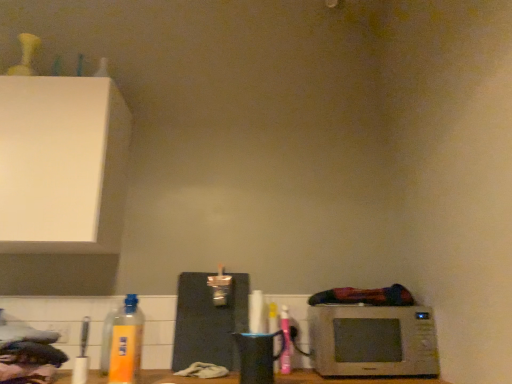
Question: Is pink matte spray can at lower right, the 3th bottle positioned from the left, thinner than white plastic electric outlet at lower left?

Choices:
 (A) yes
 (B) no

Answer: (B)

Question: Does pink matte spray can at lower right, the 3th bottle positioned from the left, come behind white plastic electric outlet at lower left?

Choices:
 (A) yes
 (B) no

Answer: (B)

Question: Can you confirm if pink matte spray can at lower right, positioned as the 3th bottle in front-to-back order, is taller than white plastic electric outlet at lower left?

Choices:
 (A) no
 (B) yes

Answer: (B)

Question: Considering the relative positions of pink matte spray can at lower right, arranged as the 1th bottle when viewed from the back, and white plastic electric outlet at lower left in the image provided, is pink matte spray can at lower right, arranged as the 1th bottle when viewed from the back, to the left of white plastic electric outlet at lower left from the viewer's perspective?

Choices:
 (A) no
 (B) yes

Answer: (A)

Question: From a real-world perspective, is pink matte spray can at lower right, the 3th bottle positioned from the left, under white plastic electric outlet at lower left?

Choices:
 (A) yes
 (B) no

Answer: (B)

Question: Is point (101, 360) closer or farther from the camera than point (389, 309)?

Choices:
 (A) farther
 (B) closer

Answer: (A)

Question: Is yellow matte bottle at lower left, which appears as the 3th bottle when viewed from the right, spatially inside silver metallic microwave at lower right, or outside of it?

Choices:
 (A) inside
 (B) outside

Answer: (B)

Question: From the image's perspective, is yellow matte bottle at lower left, acting as the second bottle starting from the front, located above or below silver metallic microwave at lower right?

Choices:
 (A) below
 (B) above

Answer: (B)

Question: From a real-world perspective, relative to silver metallic microwave at lower right, is yellow matte bottle at lower left, the first bottle from the left, vertically above or below?

Choices:
 (A) above
 (B) below

Answer: (A)

Question: Looking at their shapes, would you say yellow matte bottle at lower left, placed as the 2th bottle when sorted from right to left, is wider or thinner than silver metallic microwave at lower right?

Choices:
 (A) thin
 (B) wide

Answer: (A)

Question: From the image's perspective, is yellow matte bottle at lower left, placed as the 2th bottle when sorted from right to left, above or below silver metallic microwave at lower right?

Choices:
 (A) below
 (B) above

Answer: (B)

Question: Considering the positions of point (113, 329) and point (428, 342), is point (113, 329) closer or farther from the camera than point (428, 342)?

Choices:
 (A) farther
 (B) closer

Answer: (A)

Question: In terms of height, does yellow matte bottle at lower left, which is the second bottle in left-to-right order, look taller or shorter compared to silver metallic microwave at lower right?

Choices:
 (A) short
 (B) tall

Answer: (B)

Question: From the image's perspective, is pink matte spray can at lower right, marked as the 1th bottle in a right-to-left arrangement, located above or below black matte cutting board at center?

Choices:
 (A) below
 (B) above

Answer: (A)

Question: Is pink matte spray can at lower right, arranged as the 1th bottle when viewed from the back, situated inside black matte cutting board at center or outside?

Choices:
 (A) inside
 (B) outside

Answer: (B)